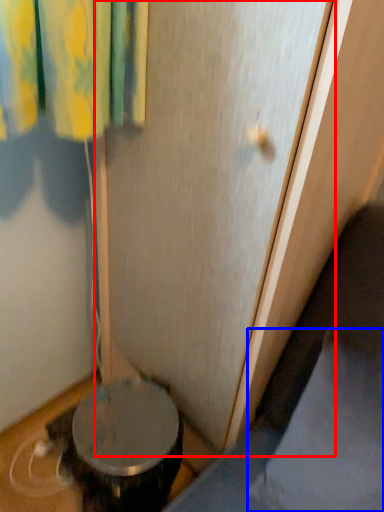
Question: Which object is further to the camera taking this photo, screen door (highlighted by a red box) or pillow (highlighted by a blue box)?

Choices:
 (A) screen door
 (B) pillow

Answer: (B)